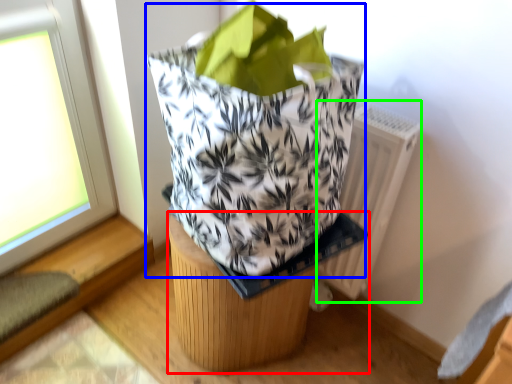
Question: Estimate the real-world distances between objects in this image. Which object is farther from furniture (highlighted by a red box), grocery bag (highlighted by a blue box) or radiator (highlighted by a green box)?

Choices:
 (A) grocery bag
 (B) radiator

Answer: (B)